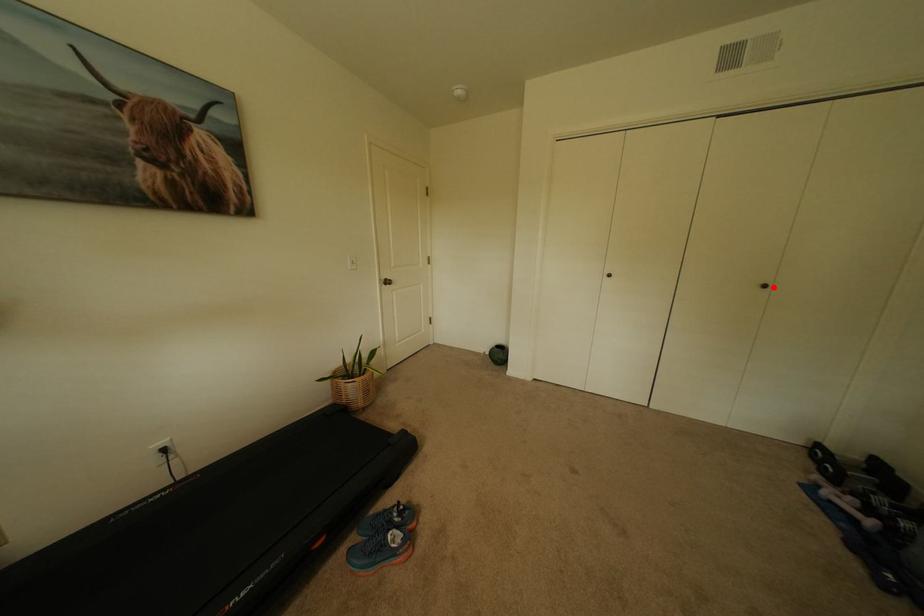
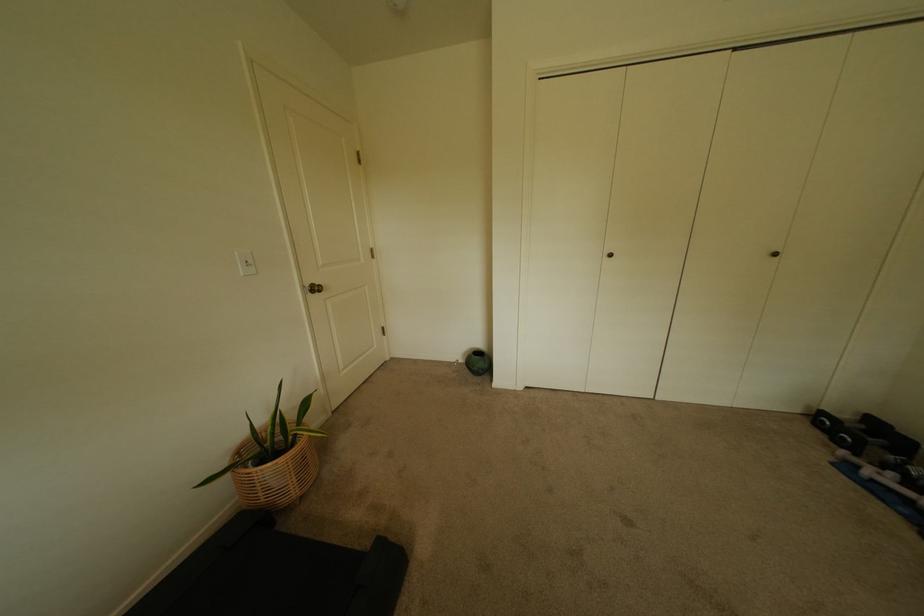
In the second image, find the point that corresponds to the highlighted location in the first image.

(784, 256)